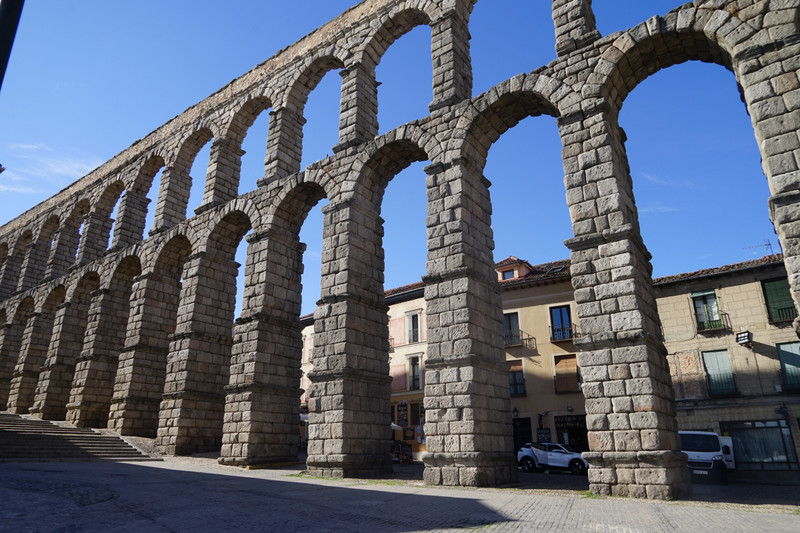
Locate an element on the screen. This screenshot has height=533, width=800. door is located at coordinates (701, 439).